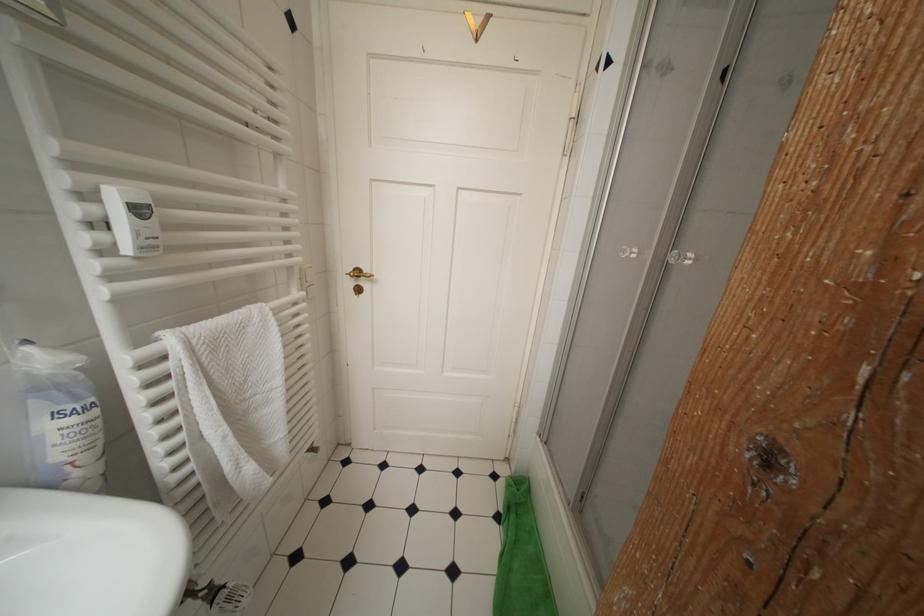
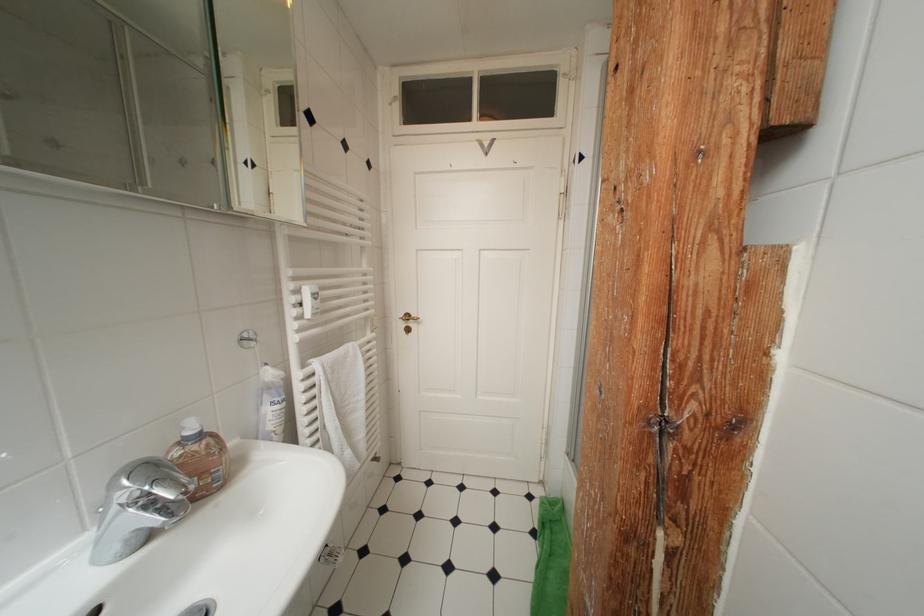
Find the pixel in the second image that matches [95,199] in the first image.

(304, 294)